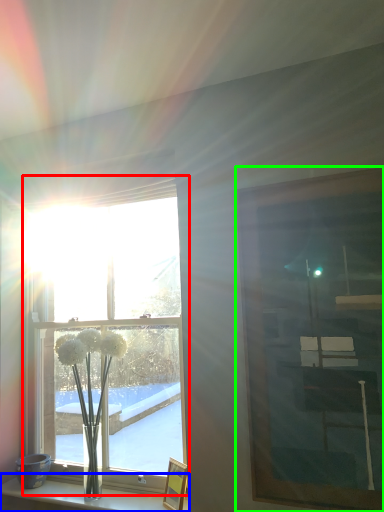
Question: Which object is positioned closest to window (highlighted by a red box)? Select from shelf (highlighted by a blue box) and picture frame (highlighted by a green box).

Choices:
 (A) shelf
 (B) picture frame

Answer: (A)